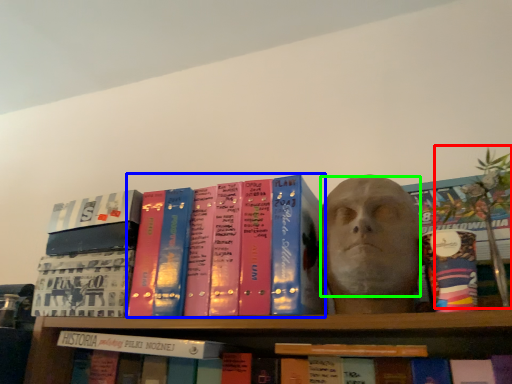
Question: Which object is positioned closest to plant (highlighted by a red box)? Select from book (highlighted by a blue box) and human face (highlighted by a green box).

Choices:
 (A) book
 (B) human face

Answer: (B)